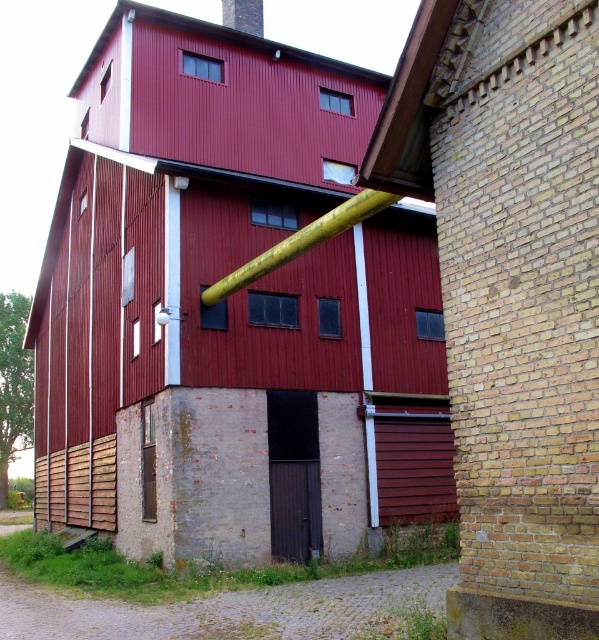
Is metallic red barn at center shorter than yellow matte pipe at center?

No, metallic red barn at center is not shorter than yellow matte pipe at center.

Image resolution: width=599 pixels, height=640 pixels. I want to click on metallic red barn at center, so click(x=231, y=308).

Find the location of a particular element. This screenshot has height=640, width=599. metallic red barn at center is located at coordinates (231, 308).

Is yellow matte pipe at center to the left of smooth yellow pipe at upper center from the viewer's perspective?

No, yellow matte pipe at center is not to the left of smooth yellow pipe at upper center.

Is point (274, 264) in front of point (252, 26)?

Yes, point (274, 264) is in front of point (252, 26).

Image resolution: width=599 pixels, height=640 pixels. What do you see at coordinates (301, 241) in the screenshot?
I see `yellow matte pipe at center` at bounding box center [301, 241].

I want to click on yellow matte pipe at center, so click(301, 241).

Measure the distance from metallic red barn at center to red corrugated metal barn at center.

metallic red barn at center is 13.47 meters from red corrugated metal barn at center.

Is metallic red barn at center thinner than red corrugated metal barn at center?

In fact, metallic red barn at center might be wider than red corrugated metal barn at center.

Is point (40, 525) in front of point (489, 512)?

No.

Identify the location of metallic red barn at center. This screenshot has width=599, height=640. (231, 308).